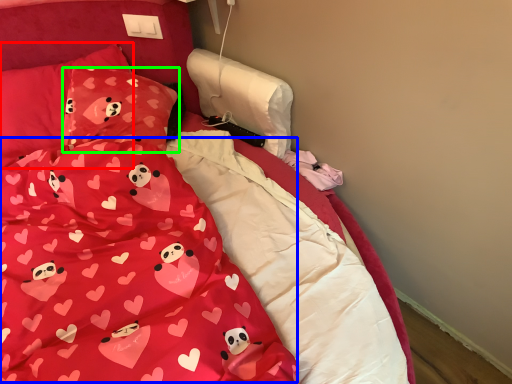
Question: Considering the real-world distances, which object is farthest from pillow (highlighted by a red box)? blanket (highlighted by a blue box) or pillow (highlighted by a green box)?

Choices:
 (A) blanket
 (B) pillow

Answer: (A)